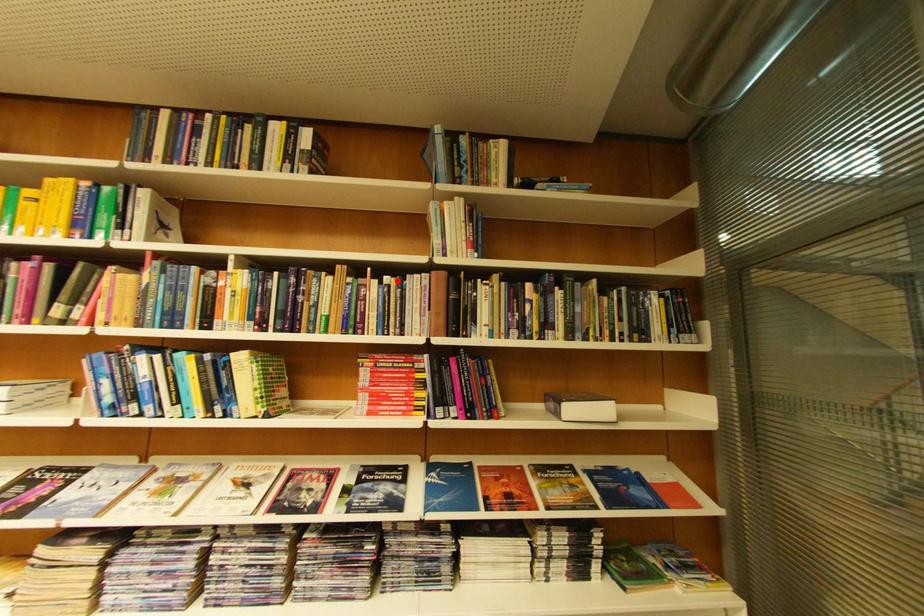
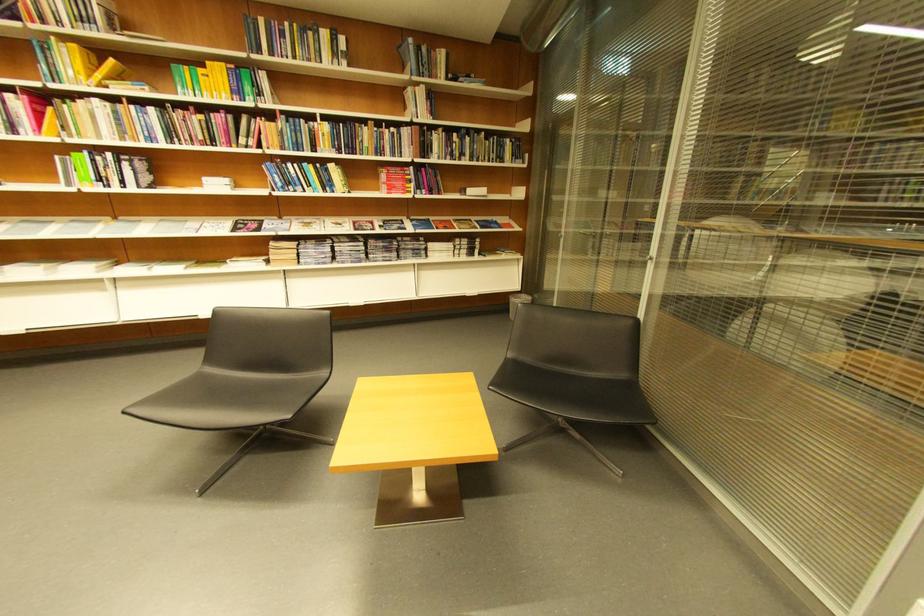
The point at the highlighted location is marked in the first image. Where is the corresponding point in the second image?

(403, 131)